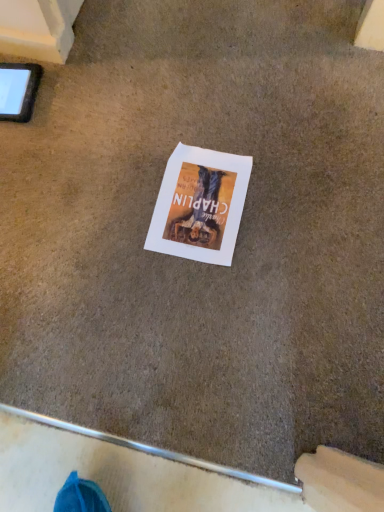
Question: Considering the relative positions of black matte tablet at upper left and white paper at center in the image provided, is black matte tablet at upper left to the left of white paper at center from the viewer's perspective?

Choices:
 (A) yes
 (B) no

Answer: (A)

Question: Can you confirm if black matte tablet at upper left is bigger than white paper at center?

Choices:
 (A) yes
 (B) no

Answer: (A)

Question: Can you confirm if black matte tablet at upper left is smaller than white paper at center?

Choices:
 (A) yes
 (B) no

Answer: (B)

Question: Can we say black matte tablet at upper left lies outside white paper at center?

Choices:
 (A) no
 (B) yes

Answer: (B)

Question: Is black matte tablet at upper left turned away from white paper at center?

Choices:
 (A) yes
 (B) no

Answer: (B)

Question: Considering the relative sizes of black matte tablet at upper left and white paper at center in the image provided, is black matte tablet at upper left shorter than white paper at center?

Choices:
 (A) no
 (B) yes

Answer: (A)

Question: Is white paper at center looking in the opposite direction of black matte tablet at upper left?

Choices:
 (A) yes
 (B) no

Answer: (B)

Question: From the image's perspective, is white paper at center on black matte tablet at upper left?

Choices:
 (A) yes
 (B) no

Answer: (B)

Question: Is white paper at center surrounding black matte tablet at upper left?

Choices:
 (A) yes
 (B) no

Answer: (B)

Question: From the image's perspective, is white paper at center below black matte tablet at upper left?

Choices:
 (A) yes
 (B) no

Answer: (A)

Question: Is white paper at center positioned before black matte tablet at upper left?

Choices:
 (A) no
 (B) yes

Answer: (B)

Question: Is white paper at center outside black matte tablet at upper left?

Choices:
 (A) no
 (B) yes

Answer: (B)

Question: Looking at the image, does black matte tablet at upper left seem bigger or smaller compared to white paper at center?

Choices:
 (A) big
 (B) small

Answer: (A)